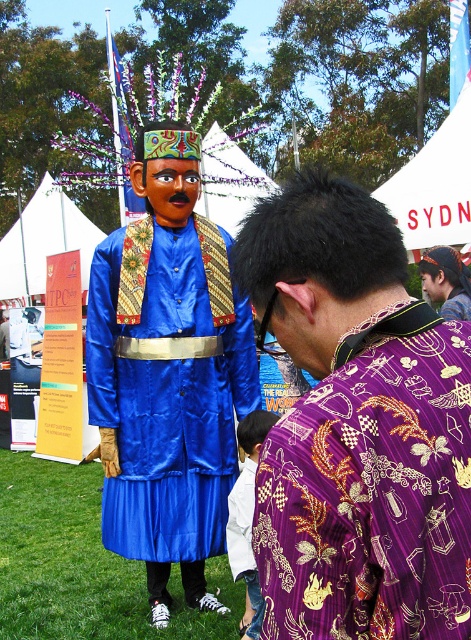
Can you confirm if blue satin robe at left is positioned to the right of purple batik shirt at center?

In fact, blue satin robe at left is to the left of purple batik shirt at center.

Based on the photo, is blue satin robe at left smaller than purple batik shirt at center?

Incorrect, blue satin robe at left is not smaller in size than purple batik shirt at center.

Is point (241, 346) closer to camera compared to point (432, 298)?

Yes, it is in front of point (432, 298).

In order to click on blue satin robe at left in this screenshot , I will do `click(167, 396)`.

Can you confirm if blue satin figure at left is positioned above purple batik shirt at center?

No.

Who is higher up, blue satin figure at left or purple batik shirt at center?

purple batik shirt at center is above.

Who is more forward, [348,452] or [454,250]?

Positioned in front is point [348,452].

Identify the location of blue satin figure at left. This screenshot has height=640, width=471. (357, 426).

Is blue satin figure at left to the left of blue satin robe at left from the viewer's perspective?

Incorrect, blue satin figure at left is not on the left side of blue satin robe at left.

Who is more forward, (336, 330) or (141, 381)?

Point (336, 330) is in front.

Locate an element on the screen. This screenshot has height=640, width=471. blue satin figure at left is located at coordinates (357, 426).